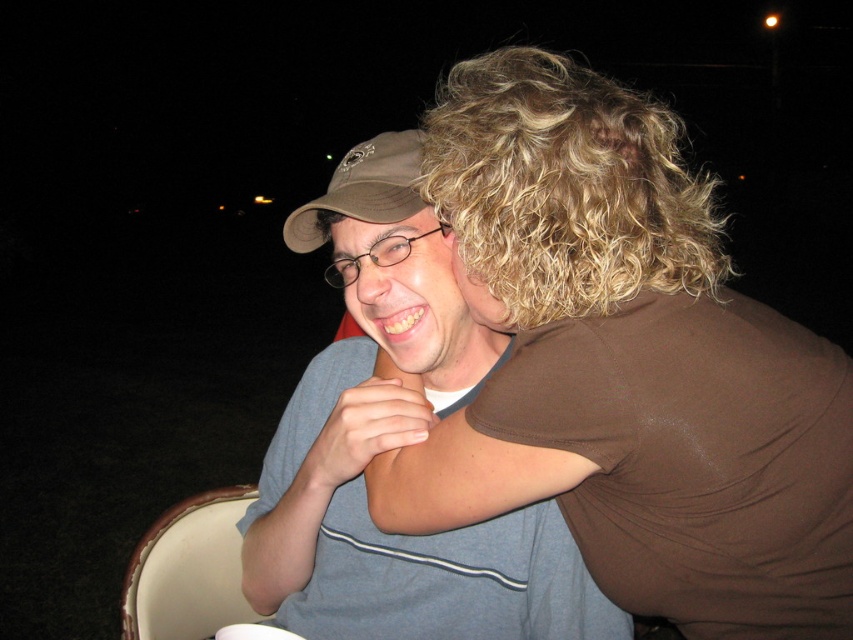
Who is higher up, brown matte shirt at upper right or curly blonde hair at upper right?

curly blonde hair at upper right is above.

Which is below, brown matte shirt at upper right or curly blonde hair at upper right?

brown matte shirt at upper right

Locate an element on the screen. This screenshot has width=853, height=640. brown matte shirt at upper right is located at coordinates (627, 365).

Does brown smooth t-shirt at upper right appear on the left side of matte gray shirt at center?

No, brown smooth t-shirt at upper right is not to the left of matte gray shirt at center.

Can you confirm if brown smooth t-shirt at upper right is positioned to the right of matte gray shirt at center?

Indeed, brown smooth t-shirt at upper right is positioned on the right side of matte gray shirt at center.

Between point (717, 314) and point (341, 451), which one is positioned behind?

Point (341, 451)

Where is `brown smooth t-shirt at upper right`? This screenshot has height=640, width=853. brown smooth t-shirt at upper right is located at coordinates (695, 460).

Which is below, matte gray shirt at center or matte brown baseball cap at upper left?

matte gray shirt at center is below.

The height and width of the screenshot is (640, 853). Describe the element at coordinates (397, 445) in the screenshot. I see `matte gray shirt at center` at that location.

In order to click on matte gray shirt at center in this screenshot , I will do `click(397, 445)`.